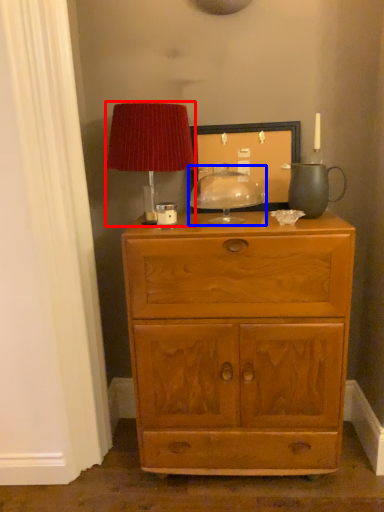
Question: Which of the following is the closest to the observer, table lamp (highlighted by a red box) or candle holder (highlighted by a blue box)?

Choices:
 (A) table lamp
 (B) candle holder

Answer: (A)